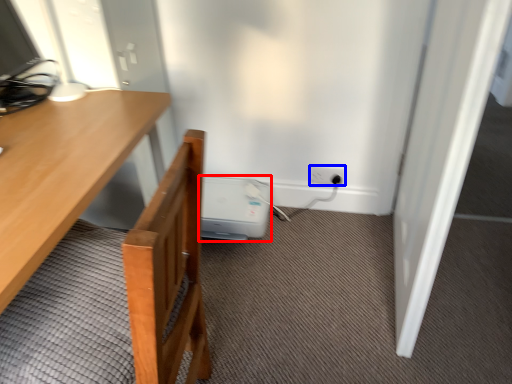
Question: Which object is further to the camera taking this photo, water heater (highlighted by a red box) or electric outlet (highlighted by a blue box)?

Choices:
 (A) water heater
 (B) electric outlet

Answer: (B)